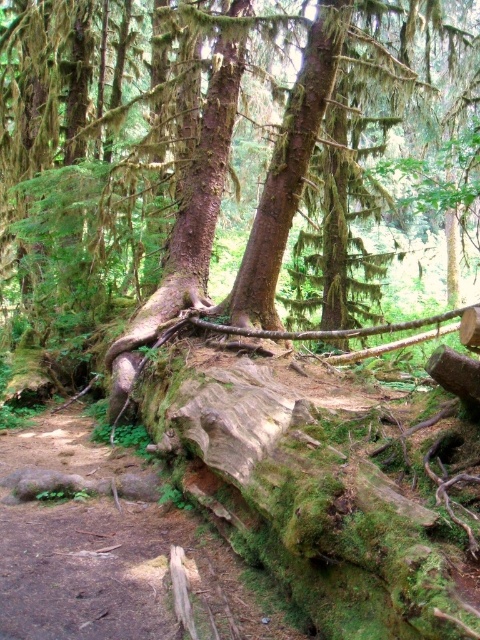
Who is more forward, (288, 225) or (252, 228)?

Point (288, 225) is more forward.

Is point (23, 67) more distant than point (298, 145)?

Yes, point (23, 67) is farther from viewer.

You are a GUI agent. You are given a task and a screenshot of the screen. Output one action in this format:
    pyautogui.click(x=<x>, y=<y>)
    Task: Click on the green mossy log at lower center
    
    Given the screenshot: What is the action you would take?
    pyautogui.click(x=224, y=173)